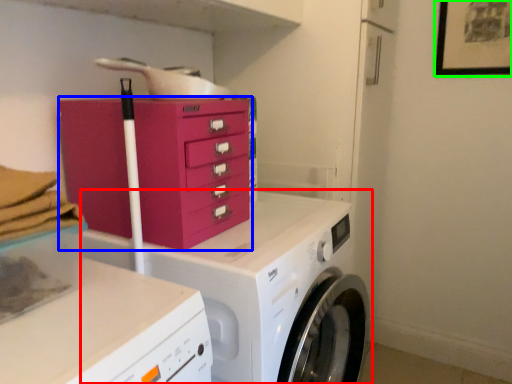
Question: Considering the real-world distances, which object is closest to washing machine (highlighted by a red box)? chest of drawers (highlighted by a blue box) or picture frame (highlighted by a green box).

Choices:
 (A) chest of drawers
 (B) picture frame

Answer: (A)